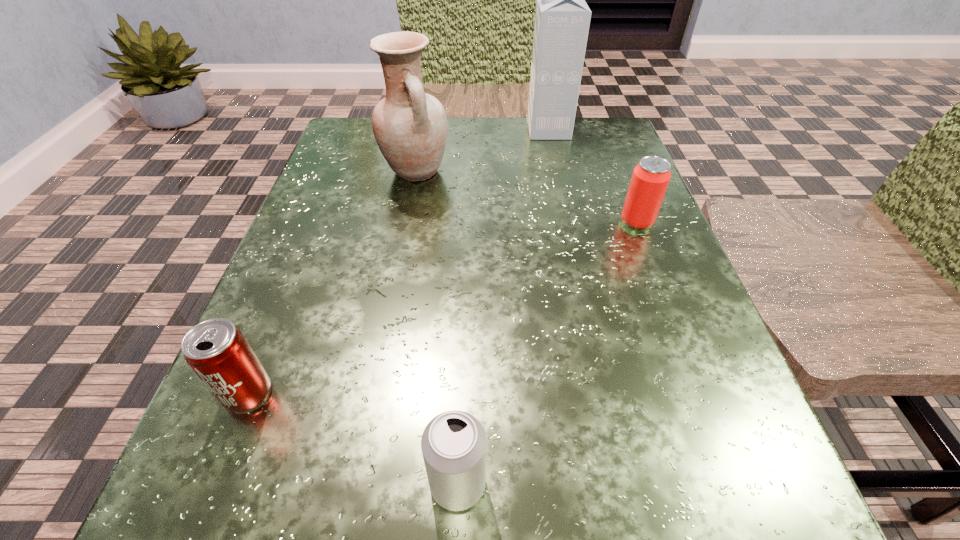
At what (x,y) coordinates should I click in order to perform the action: click on pottery at the left edge. Please return your answer as a coordinate pair (x, y). The width and height of the screenshot is (960, 540). Looking at the image, I should click on (410, 126).

This screenshot has width=960, height=540. What are the coordinates of `beer can positioned at the left edge` in the screenshot? It's located at (216, 350).

Locate an element on the screen. This screenshot has width=960, height=540. carton located in the right edge section of the desktop is located at coordinates (562, 19).

This screenshot has width=960, height=540. Identify the location of beer can that is positioned at the right edge. (650, 178).

The height and width of the screenshot is (540, 960). Find the location of `object that is positioned at the far left corner`. object that is positioned at the far left corner is located at coordinates (410, 126).

Where is `object that is positioned at the far right corner`? object that is positioned at the far right corner is located at coordinates (562, 19).

Identify the location of free region at the far edge of the desktop. (470, 141).

What are the coordinates of `vacant area at the near edge of the desktop` in the screenshot? It's located at (406, 528).

At what (x,y) coordinates should I click in order to perform the action: click on free space at the left edge of the desktop. Please return your answer as a coordinate pair (x, y). Looking at the image, I should click on 360,220.

In the image, there is a desktop. At what (x,y) coordinates should I click in order to perform the action: click on vacant space at the right edge. Please return your answer as a coordinate pair (x, y). Image resolution: width=960 pixels, height=540 pixels. Looking at the image, I should click on (594, 297).